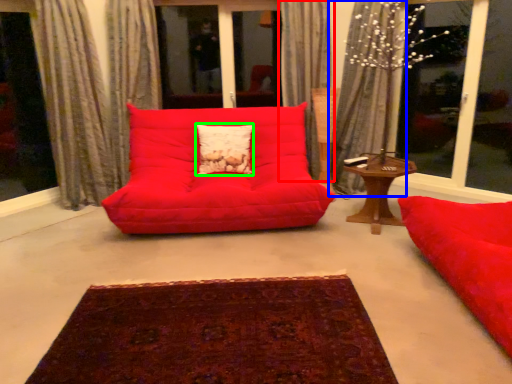
Question: Considering the real-world distances, which object is farthest from curtain (highlighted by a red box)? curtain (highlighted by a blue box) or pillow (highlighted by a green box)?

Choices:
 (A) curtain
 (B) pillow

Answer: (B)